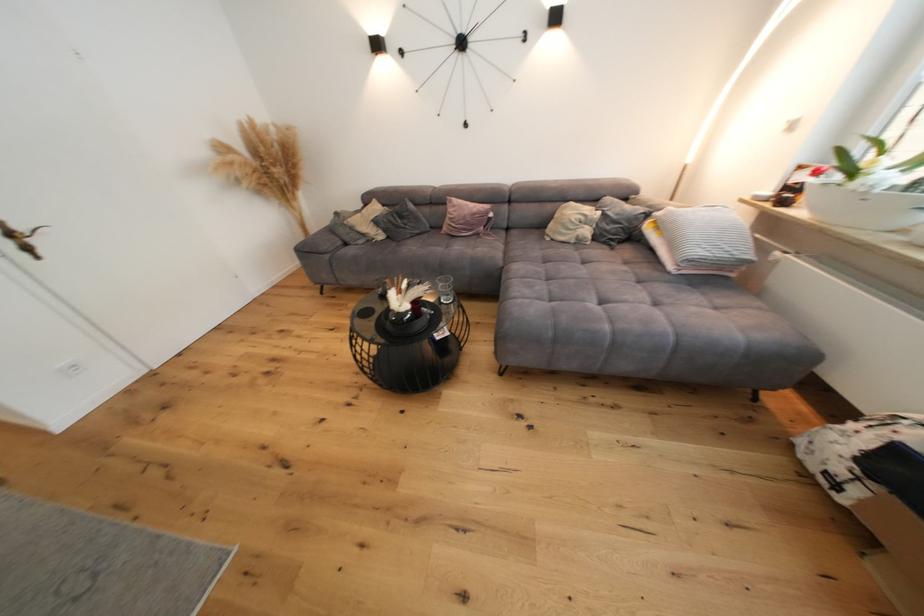
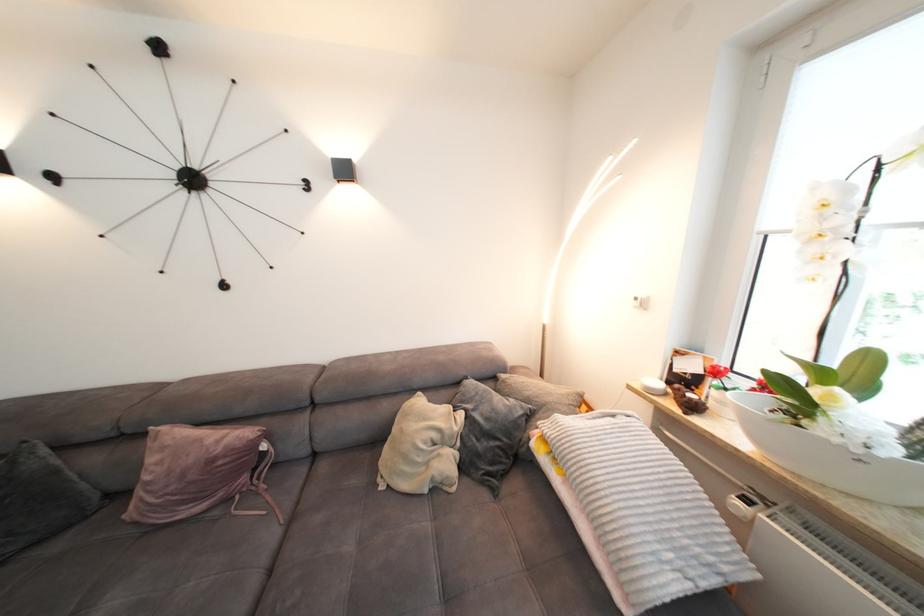
Find the pixel in the second image that matches the point at 460,208 in the first image.

(171, 448)